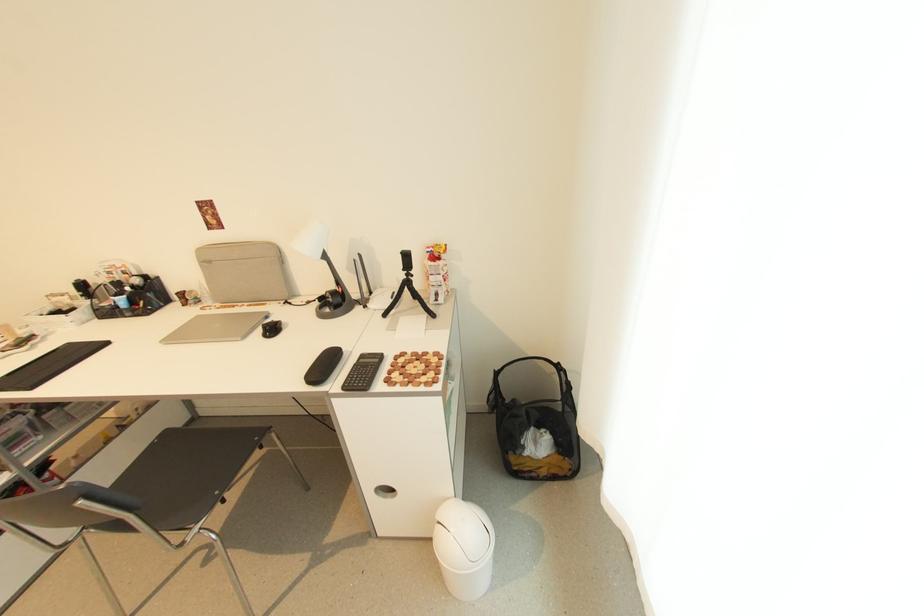
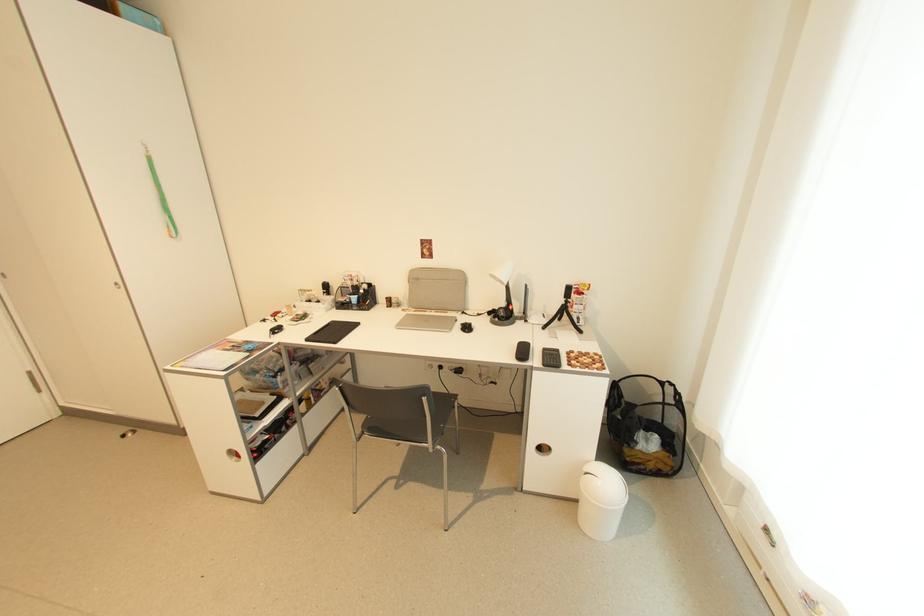
Question: I am providing you with two images of the same scene from different viewpoints. Which of the following objects are not visible in image2?

Choices:
 (A) green lanyard
 (B) white trash can lid
 (C) chair sitting surface
 (D) none of these

Answer: (D)